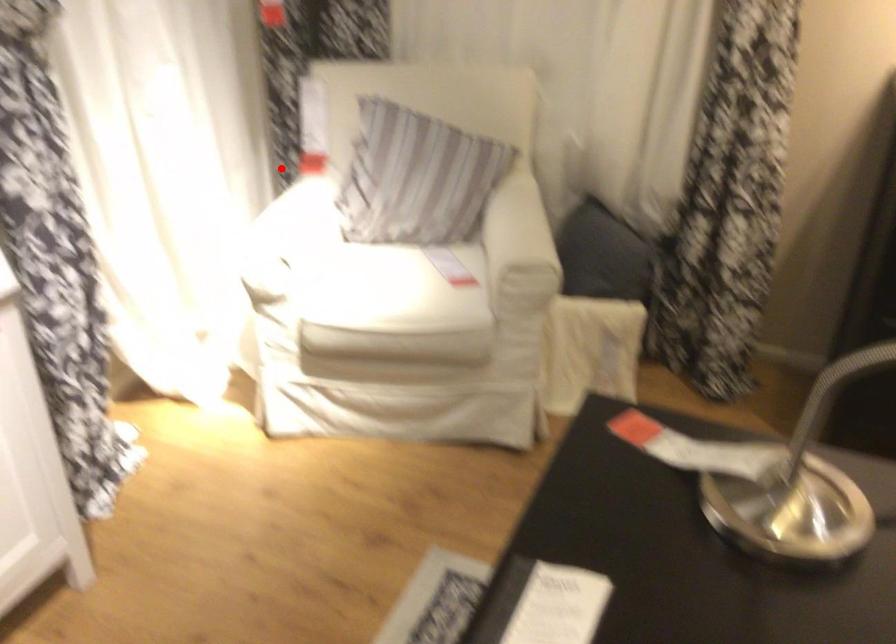
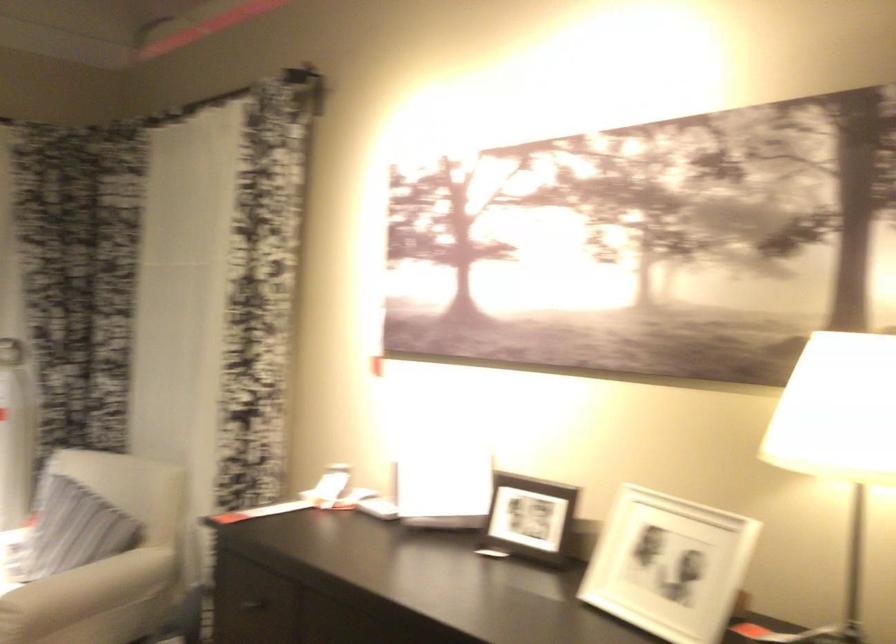
Question: I am providing you with two images of the same scene from different viewpoints. Image1 has a red point marked. In image2, the corresponding 3D location appears at what relative position? Reply with the corresponding letter.

Choices:
 (A) Closer
 (B) Farther

Answer: (B)